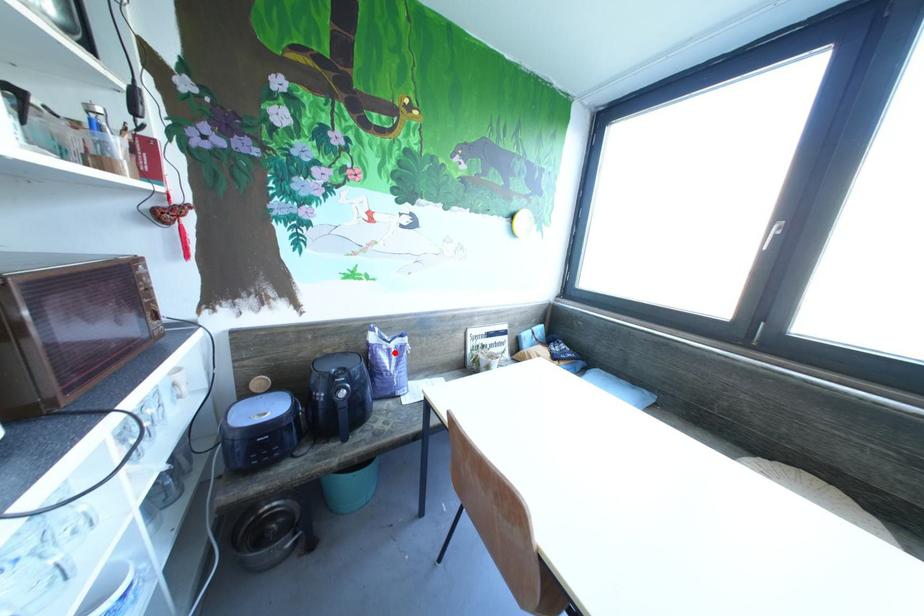
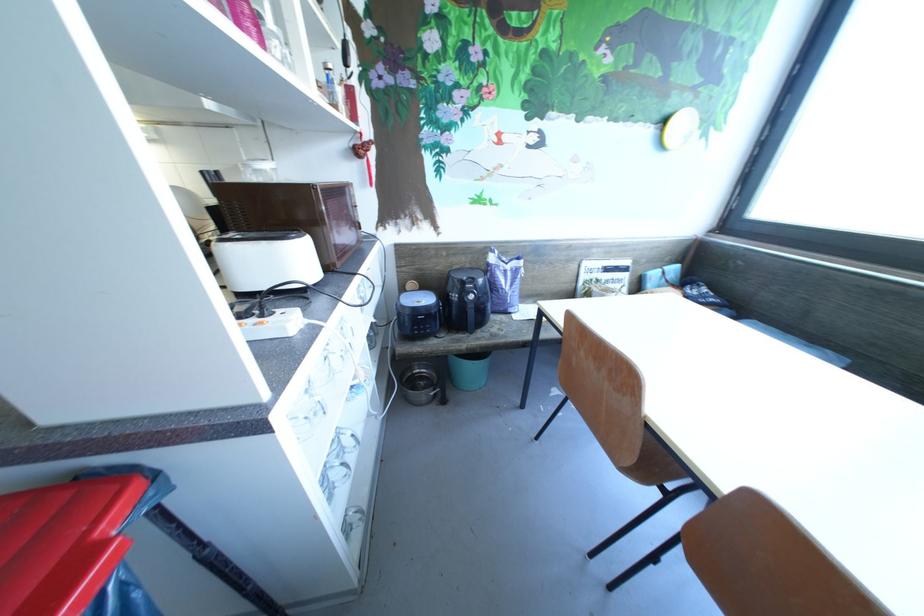
Question: I am providing you with two images of the same scene from different viewpoints. Image1 has a red point marked. In image2, the corresponding 3D location appears at what relative position? Reply with the corresponding letter.

Choices:
 (A) Closer
 (B) Farther

Answer: (A)